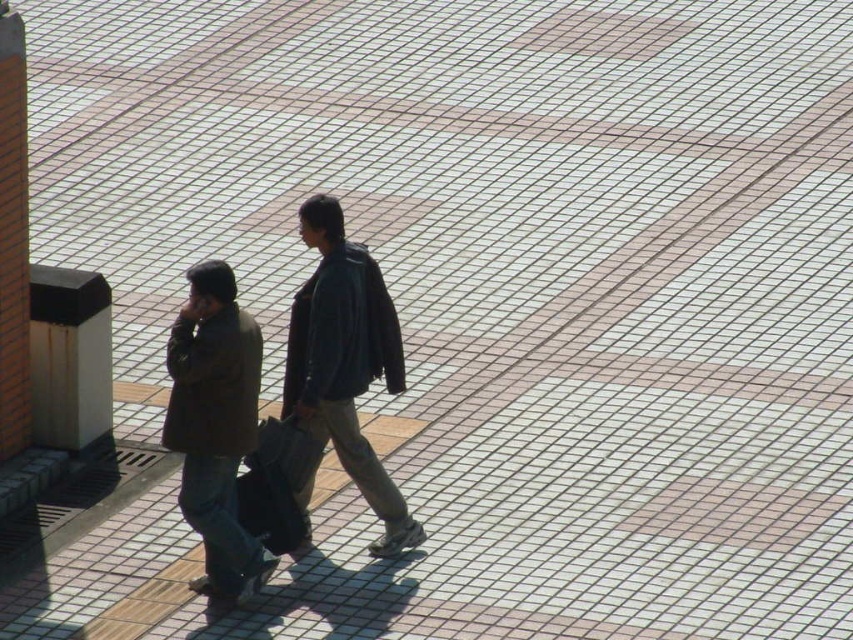
Question: Which point is closer to the camera taking this photo?

Choices:
 (A) (292, 392)
 (B) (218, 276)
 (C) (350, 424)

Answer: (B)

Question: Which point is closer to the camera taking this photo?

Choices:
 (A) (221, 384)
 (B) (310, 353)

Answer: (A)

Question: Is dark brown leather jacket at center above brown matte jacket at center?

Choices:
 (A) no
 (B) yes

Answer: (B)

Question: Does dark blue leather jacket at center appear on the right side of brown matte jacket at center?

Choices:
 (A) no
 (B) yes

Answer: (B)

Question: Is dark blue leather jacket at center wider than brown matte jacket at center?

Choices:
 (A) yes
 (B) no

Answer: (A)

Question: Which point is farther to the camera?

Choices:
 (A) dark brown leather jacket at center
 (B) dark blue leather jacket at center

Answer: (B)